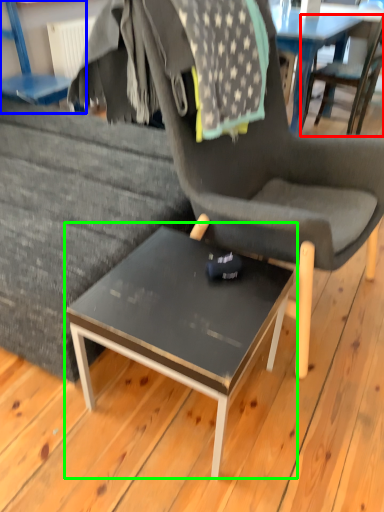
Question: Estimate the real-world distances between objects in this image. Which object is farther from chair (highlighted by a red box), chair (highlighted by a blue box) or coffee table (highlighted by a green box)?

Choices:
 (A) chair
 (B) coffee table

Answer: (B)